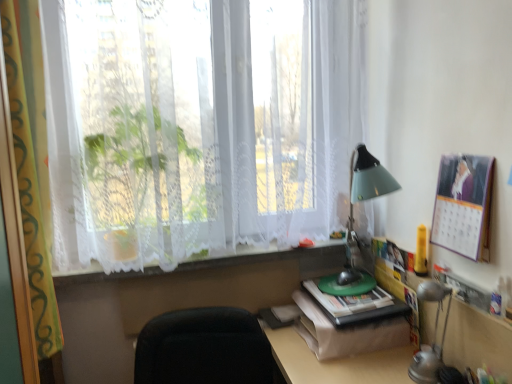
Question: Should I look upward or downward to see black fabric chair at lower center?

Choices:
 (A) down
 (B) up

Answer: (A)

Question: Is green matte book at bottom right shorter than matte paper calendar at upper right?

Choices:
 (A) yes
 (B) no

Answer: (A)

Question: From a real-world perspective, does green matte book at bottom right sit lower than matte paper calendar at upper right?

Choices:
 (A) yes
 (B) no

Answer: (A)

Question: Could you tell me if green matte book at bottom right is facing matte paper calendar at upper right?

Choices:
 (A) yes
 (B) no

Answer: (B)

Question: Does green matte book at bottom right have a smaller size compared to matte paper calendar at upper right?

Choices:
 (A) no
 (B) yes

Answer: (A)

Question: Would you consider green matte book at bottom right to be distant from matte paper calendar at upper right?

Choices:
 (A) yes
 (B) no

Answer: (B)

Question: Is green matte book at bottom right with matte paper calendar at upper right?

Choices:
 (A) yes
 (B) no

Answer: (B)

Question: Can you confirm if black fabric chair at lower center is taller than white lace curtain at left?

Choices:
 (A) yes
 (B) no

Answer: (B)

Question: Is black fabric chair at lower center thinner than white lace curtain at left?

Choices:
 (A) yes
 (B) no

Answer: (B)

Question: Would you say black fabric chair at lower center is a long distance from white lace curtain at left?

Choices:
 (A) yes
 (B) no

Answer: (B)

Question: Is black fabric chair at lower center not inside white lace curtain at left?

Choices:
 (A) yes
 (B) no

Answer: (A)

Question: Considering the relative sizes of black fabric chair at lower center and white lace curtain at left in the image provided, is black fabric chair at lower center shorter than white lace curtain at left?

Choices:
 (A) no
 (B) yes

Answer: (B)

Question: Does black fabric chair at lower center contain white lace curtain at left?

Choices:
 (A) yes
 (B) no

Answer: (B)

Question: From the image's perspective, is metallic silver table lamp at lower right on top of matte paper calendar at upper right?

Choices:
 (A) no
 (B) yes

Answer: (A)